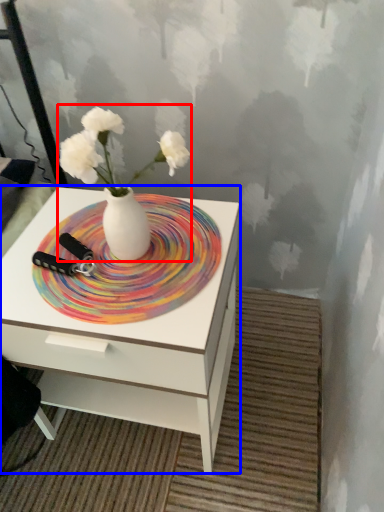
Question: Which object appears closest to the camera in this image, floral arrangement (highlighted by a red box) or nightstand (highlighted by a blue box)?

Choices:
 (A) floral arrangement
 (B) nightstand

Answer: (A)